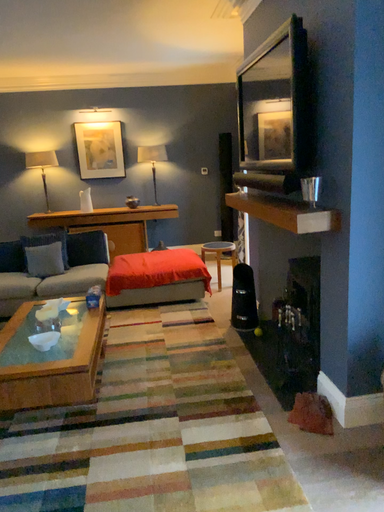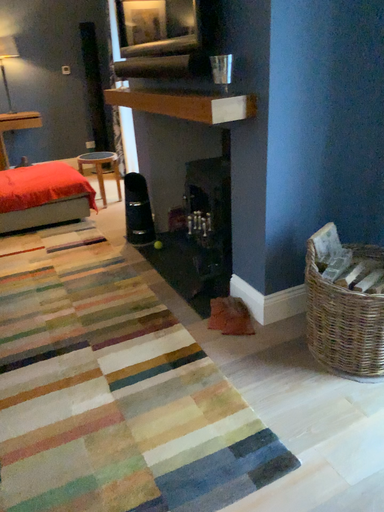
Question: How did the camera likely rotate when shooting the video?

Choices:
 (A) rotated upward
 (B) rotated downward

Answer: (B)